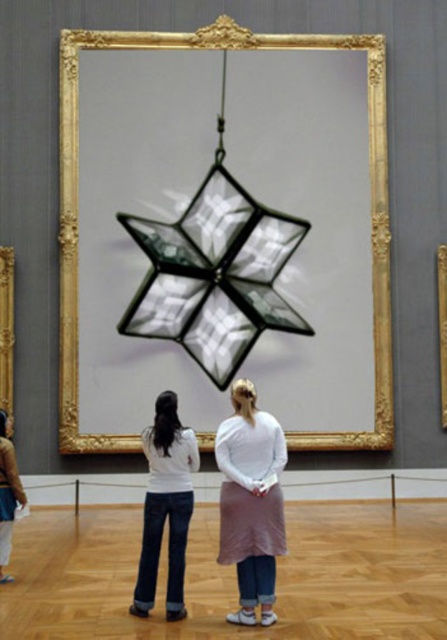
Question: Estimate the real-world distances between objects in this image. Which object is farther from the gold/gilded picture frame at center?

Choices:
 (A) gold/gilded wood picture frame at upper center
 (B) white matte jeans at lower center

Answer: (B)

Question: Which is nearer to the gold/gilded picture frame at center?

Choices:
 (A) gold/gilded wood picture frame at center
 (B) denim jeans at lower left
 (C) white cotton skirt at center
 (D) gold/gilded wood picture frame at upper center

Answer: (D)

Question: Is white matte jeans at lower center positioned at the back of gold/gilded wood picture frame at upper center?

Choices:
 (A) no
 (B) yes

Answer: (A)

Question: Can you confirm if gold/gilded picture frame at center is wider than denim jeans at lower left?

Choices:
 (A) yes
 (B) no

Answer: (A)

Question: Does denim jeans at lower left appear on the left side of gold/gilded wood picture frame at upper center?

Choices:
 (A) no
 (B) yes

Answer: (A)

Question: Which point is closer to the camera?

Choices:
 (A) white matte jeans at lower center
 (B) white cotton skirt at center

Answer: (B)